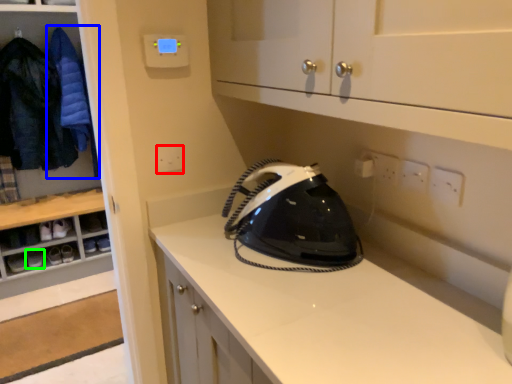
Question: Considering the real-world distances, which object is closest to electric outlet (highlighted by a red box)? clothing (highlighted by a blue box) or footwear (highlighted by a green box).

Choices:
 (A) clothing
 (B) footwear

Answer: (A)